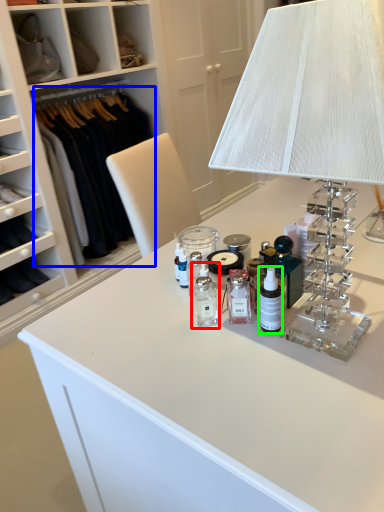
Question: Which is farther away from toiletry (highlighted by a red box)? clothing (highlighted by a blue box) or toiletry (highlighted by a green box)?

Choices:
 (A) clothing
 (B) toiletry

Answer: (A)